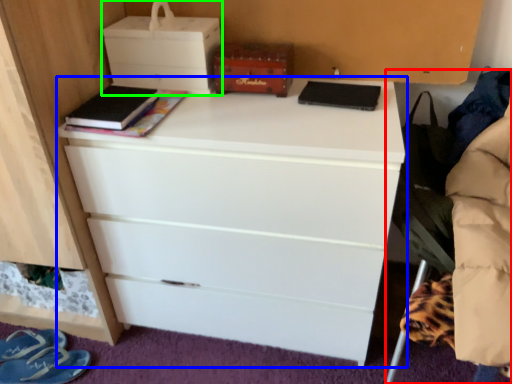
Question: Which object is positioned farthest from swivel chair (highlighted by a red box)? Select from chest of drawers (highlighted by a blue box) and storage box (highlighted by a green box).

Choices:
 (A) chest of drawers
 (B) storage box

Answer: (B)